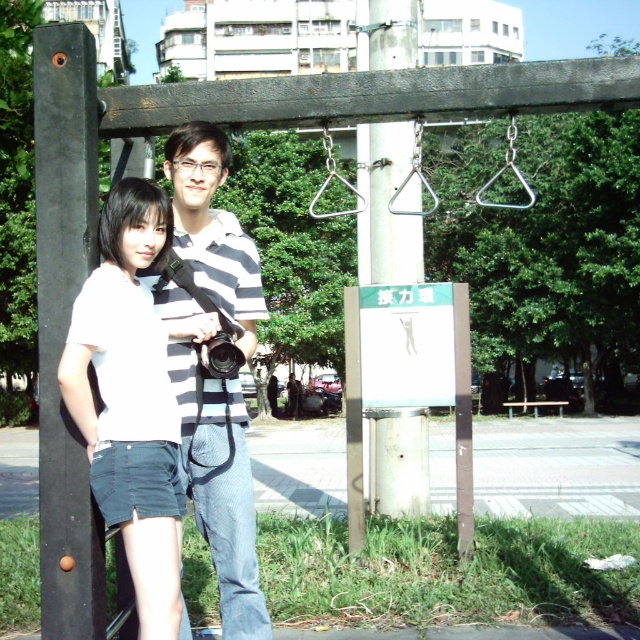
Who is more distant from viewer, [189,308] or [385,458]?

The point [385,458] is behind.

Between point (179, 384) and point (392, 480), which one is positioned in front?

Point (179, 384) is more forward.

This screenshot has width=640, height=640. I want to click on striped cotton shirt at center, so click(216, 467).

Identify the location of striped cotton shirt at center. (216, 467).

Can you confirm if black matte pole at left is smaller than striped cotton shirt at center?

Indeed, black matte pole at left has a smaller size compared to striped cotton shirt at center.

Is point (83, 120) more distant than point (163, 168)?

No, it is in front of (163, 168).

This screenshot has width=640, height=640. I want to click on black matte pole at left, so click(x=65, y=324).

Does metallic pole at center have a smaller size compared to black plastic camera at center?

Actually, metallic pole at center might be larger than black plastic camera at center.

Does metallic pole at center have a greater width compared to black plastic camera at center?

Yes, metallic pole at center is wider than black plastic camera at center.

Who is more forward, (x=380, y=49) or (x=216, y=372)?

Point (x=216, y=372) is in front.

Identify the location of metallic pole at center. The height and width of the screenshot is (640, 640). (392, 204).